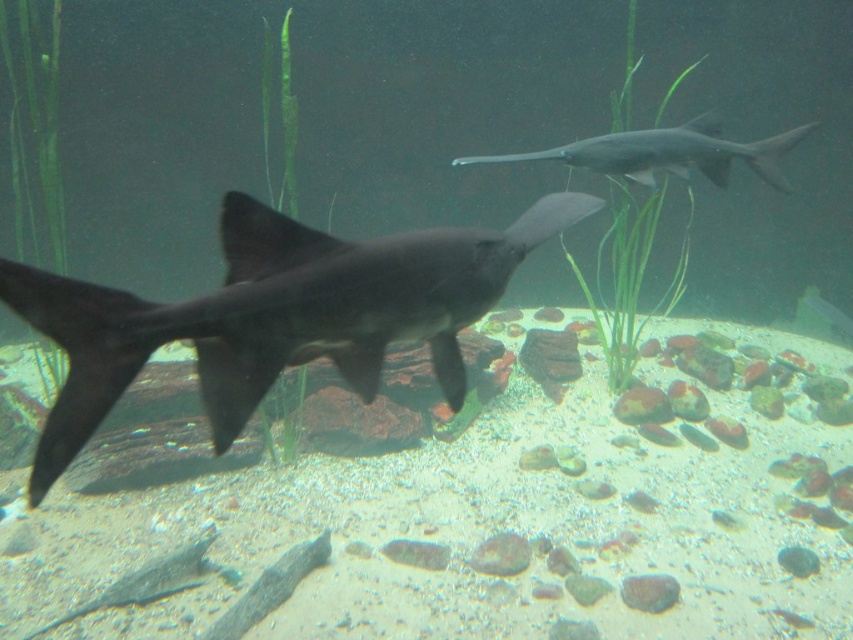
You are an underwater photographer aiming to capture both the matte black shark at center and the smooth gray shark at upper center in a single frame. Based on their positions, which shark should you adjust your camera to focus on first to ensure both are in the shot?

The matte black shark at center is to the left of the smooth gray shark at upper center, so you should focus on the smooth gray shark at upper center first to ensure both are in the frame.

You are an underwater photographer planning to capture the matte black shark at center and the smooth gray shark at upper center in a single frame. Based on their positions and sizes, which shark will appear larger in the photo?

The matte black shark at center will appear larger in the photo because it has a greater height compared to the smooth gray shark at upper center.